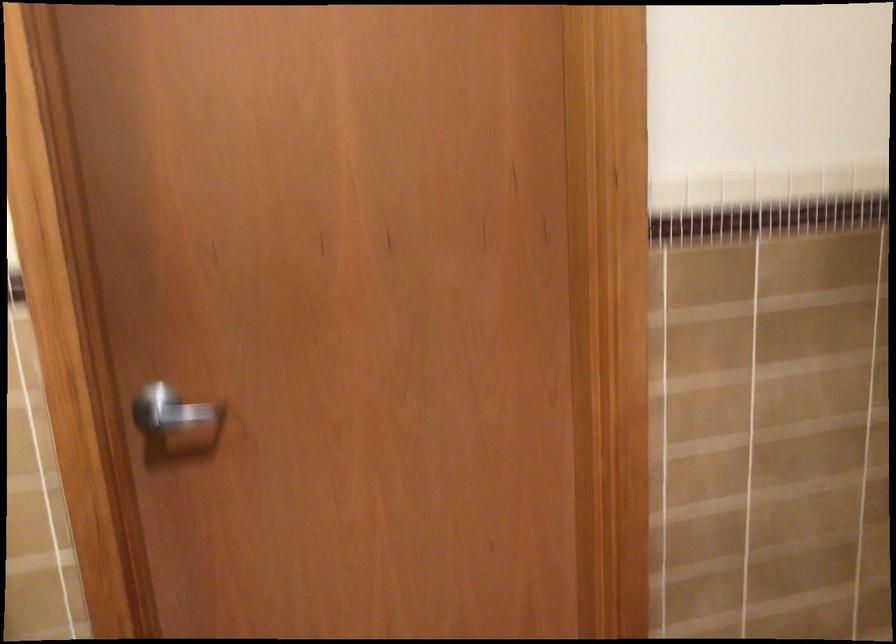
Question: How did the camera likely rotate?

Choices:
 (A) Left
 (B) Right
 (C) Up
 (D) Down

Answer: (B)